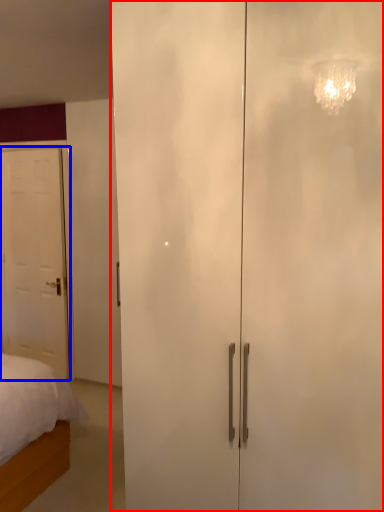
Question: Which object is further to the camera taking this photo, door (highlighted by a red box) or door (highlighted by a blue box)?

Choices:
 (A) door
 (B) door

Answer: (B)